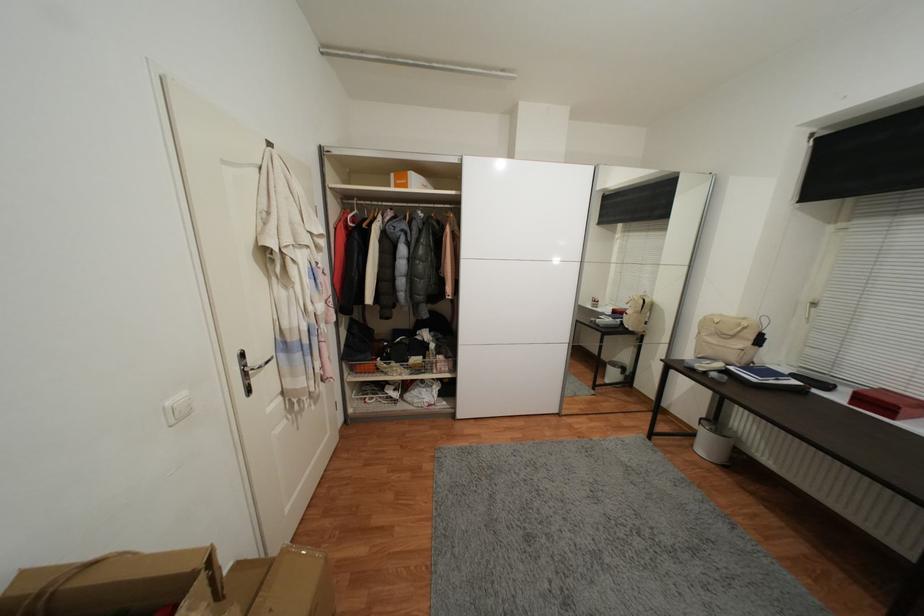
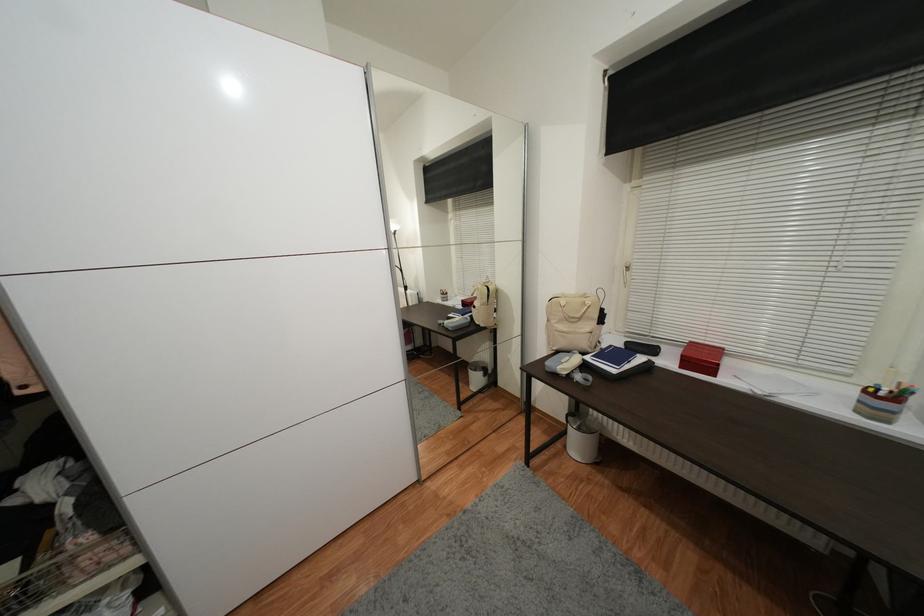
Where in the second image is the point corresponding to (x=736, y=369) from the first image?

(592, 360)